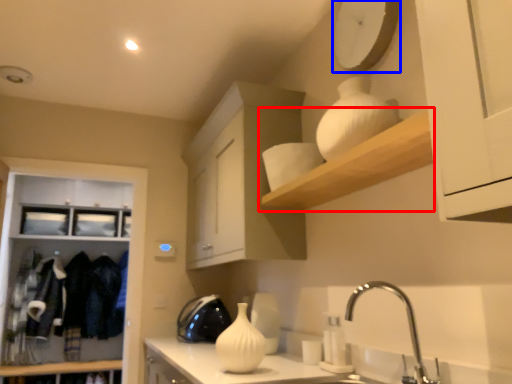
Question: Which point is closer to the camera, shelf (highlighted by a red box) or clock (highlighted by a blue box)?

Choices:
 (A) shelf
 (B) clock

Answer: (A)